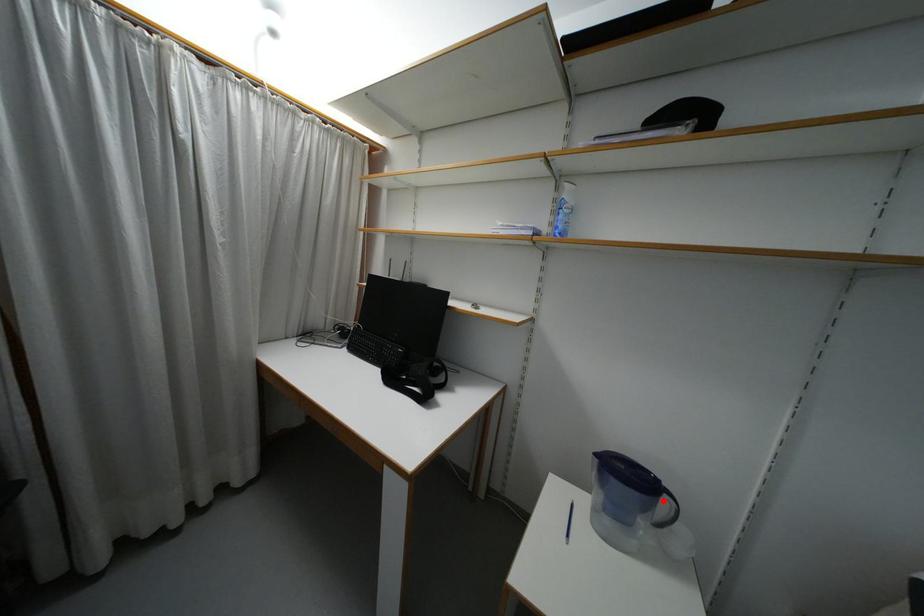
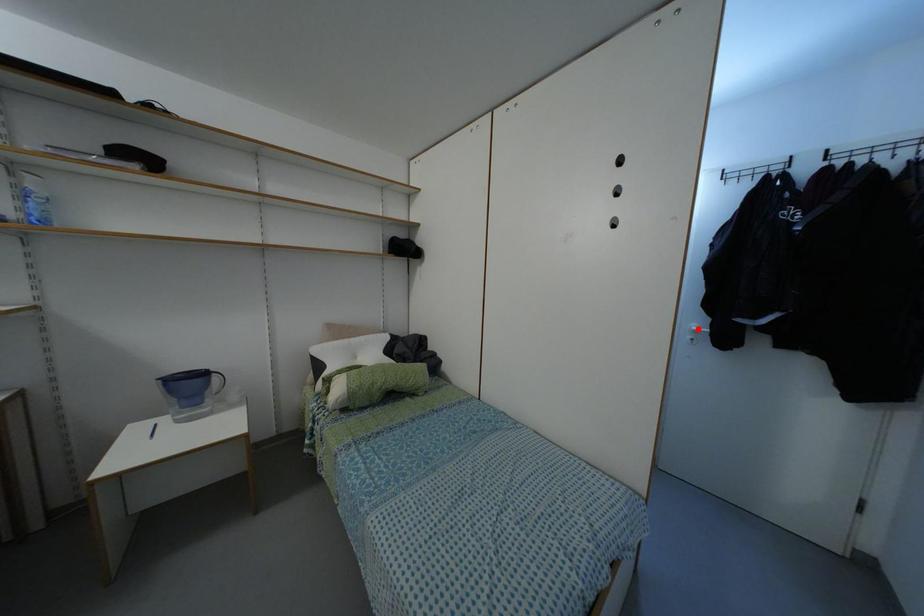
I am providing you with two images of the same scene from different viewpoints. A red point is marked on the first image and another point is marked on the second image. Are the points marked in image1 and image2 representing the same 3D position?

No